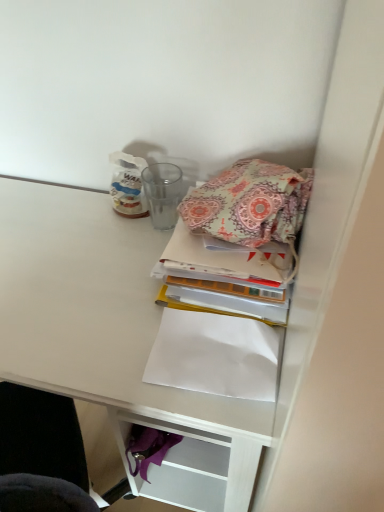
Question: Relative to paisley fabric book at center, is white matte desk at upper right in front or behind?

Choices:
 (A) behind
 (B) front

Answer: (B)

Question: From a real-world perspective, is white matte desk at upper right physically located above or below paisley fabric book at center?

Choices:
 (A) below
 (B) above

Answer: (A)

Question: Which of these objects is positioned farthest from the paisley fabric book at center?

Choices:
 (A) white matte desk at upper right
 (B) white paper at lower center
 (C) patterned fabric bag at upper right

Answer: (A)

Question: Based on their relative distances, which object is nearer to the white paper at lower center?

Choices:
 (A) patterned fabric bag at upper right
 (B) white matte desk at upper right
 (C) paisley fabric book at center

Answer: (C)